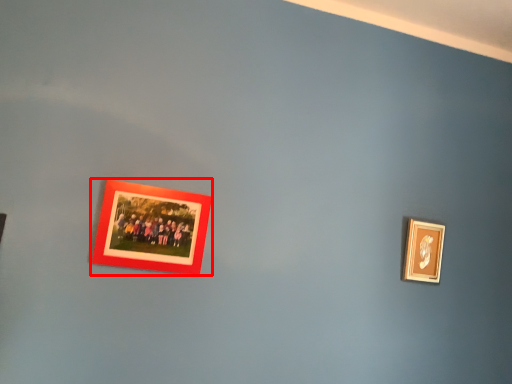
Question: From the image's perspective, considering the relative positions of picture frame (annotated by the red box) and picture frame in the image provided, where is picture frame (annotated by the red box) located with respect to the staircase?

Choices:
 (A) above
 (B) below

Answer: (A)